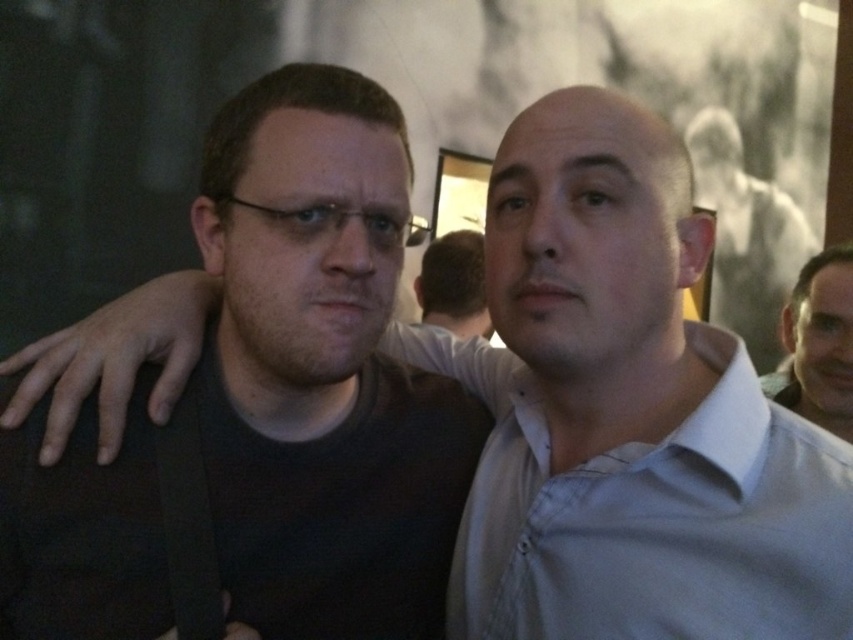
Question: From the image, what is the correct spatial relationship of smooth skin face at right in relation to dark brown hair at center?

Choices:
 (A) right
 (B) left

Answer: (A)

Question: Does smooth skin face at right appear under dark brown hair at center?

Choices:
 (A) yes
 (B) no

Answer: (A)

Question: Among these objects, which one is nearest to the camera?

Choices:
 (A) dark brown hair at center
 (B) smooth skin face at right

Answer: (B)

Question: Which of the following is the closest to the observer?

Choices:
 (A) (787, 310)
 (B) (448, 324)

Answer: (A)

Question: Is smooth skin face at right positioned before dark brown hair at center?

Choices:
 (A) yes
 (B) no

Answer: (A)

Question: Which point is farther to the camera?

Choices:
 (A) dark brown hair at center
 (B) smooth skin face at right

Answer: (A)